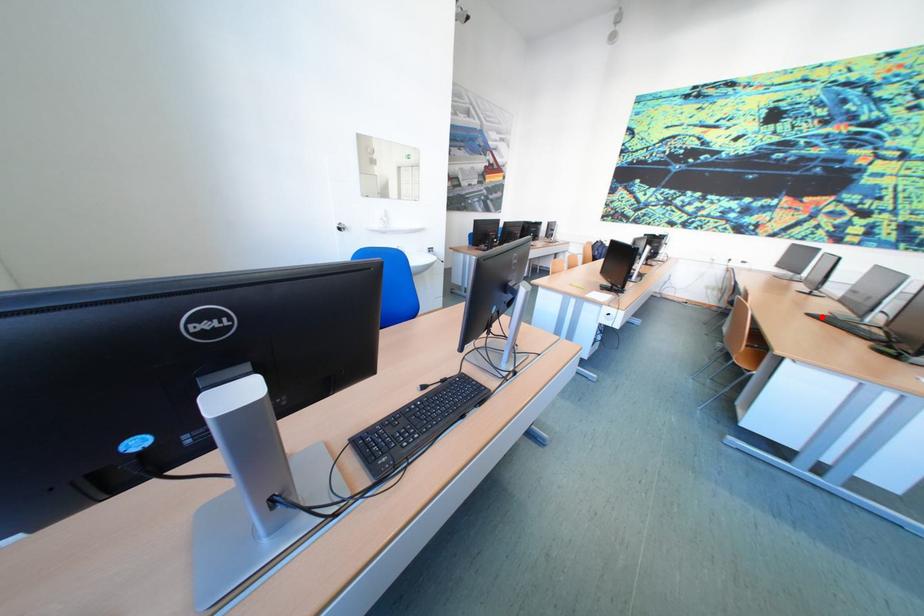
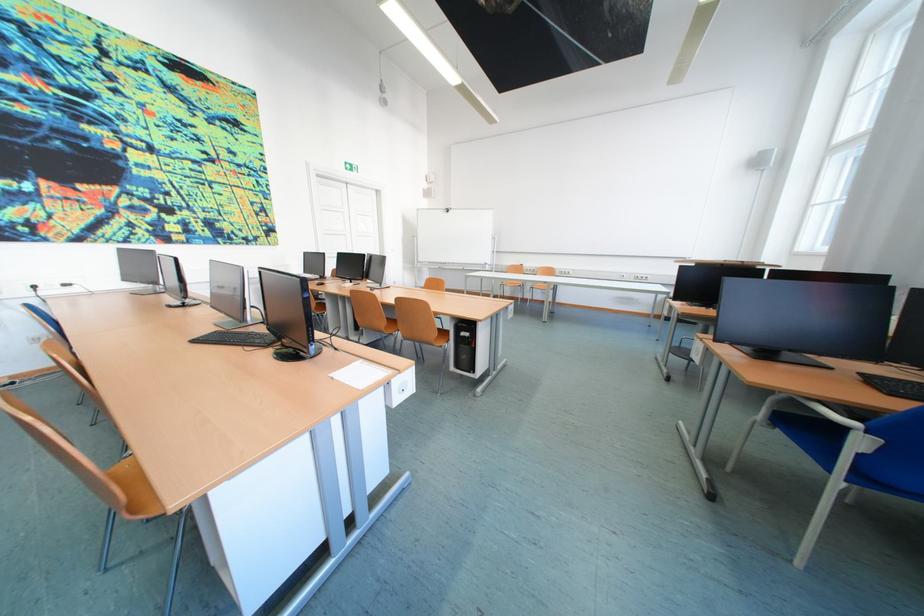
Find the pixel in the second image that matches the highlighted location in the first image.

(208, 342)